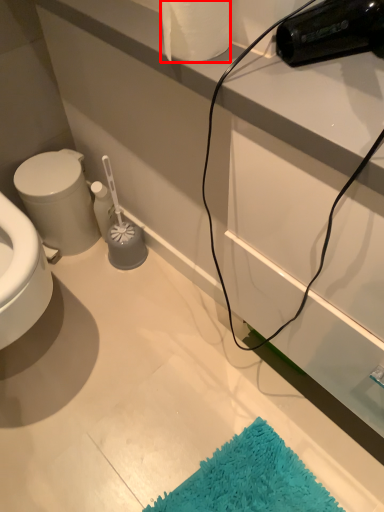
Question: Considering the relative positions of toilet paper (annotated by the red box) and bidet in the image provided, where is toilet paper (annotated by the red box) located with respect to the staircase?

Choices:
 (A) right
 (B) left

Answer: (A)